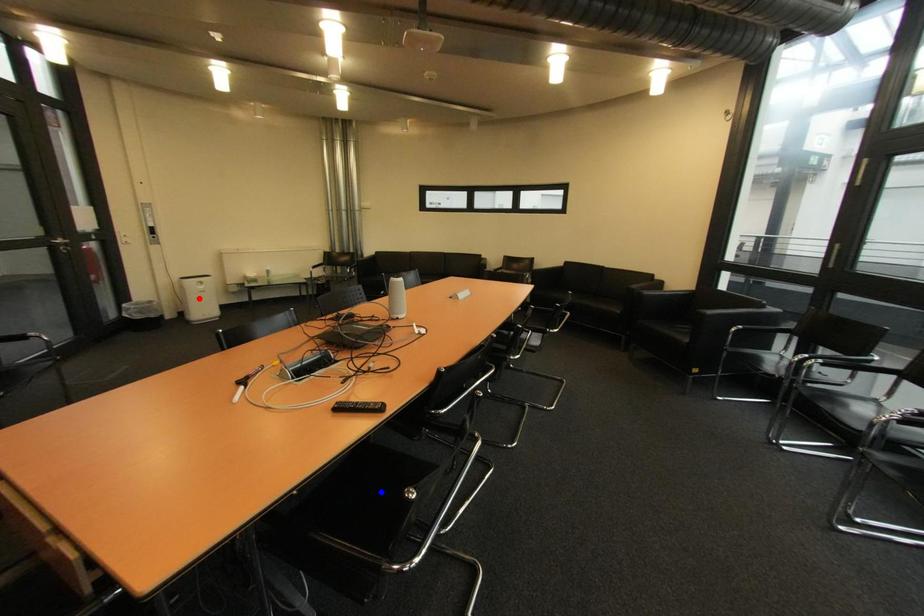
Question: In the image, two points are highlighted. Which point is nearer to the camera? Reply with the corresponding letter.

Choices:
 (A) blue point
 (B) red point

Answer: (A)